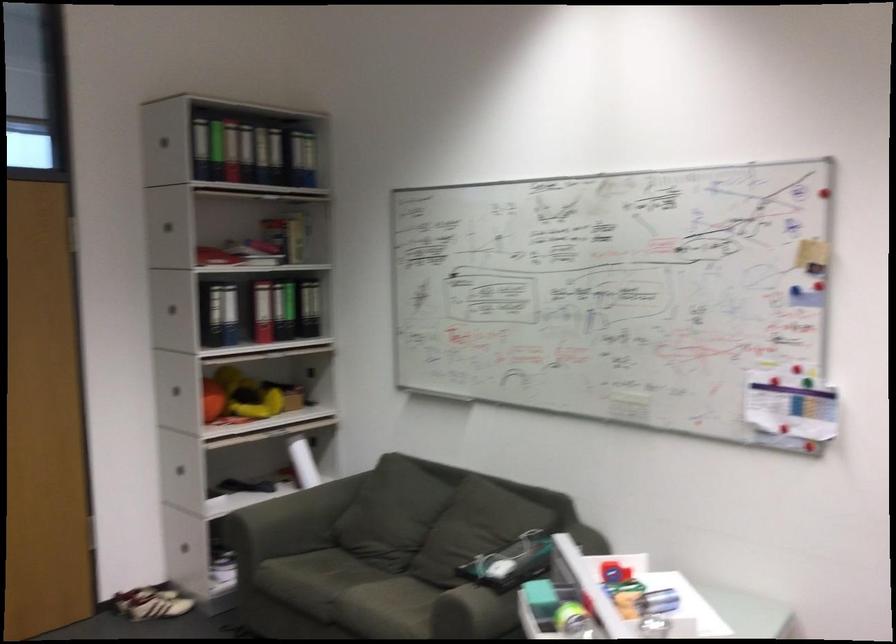
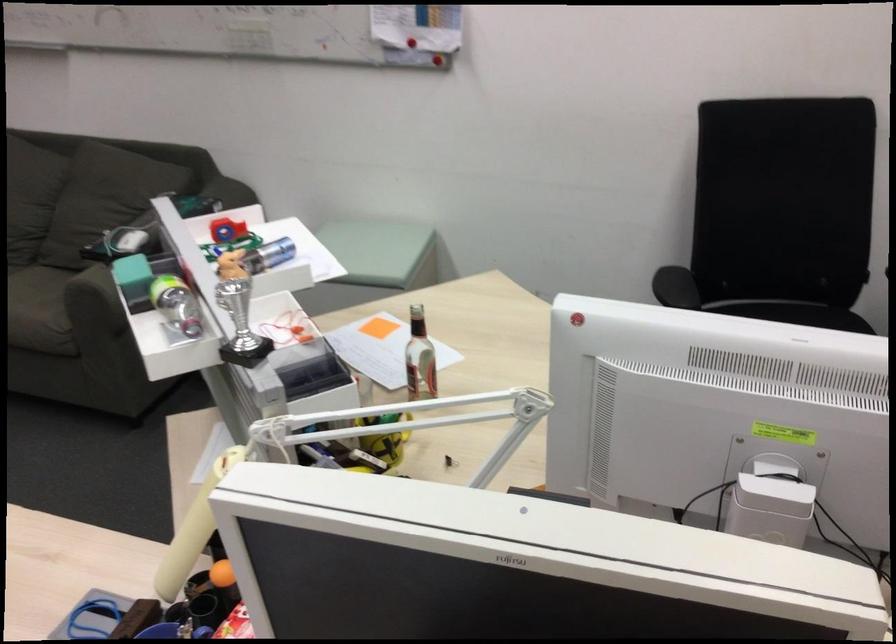
The point at (761, 398) is marked in the first image. Where is the corresponding point in the second image?

(401, 13)